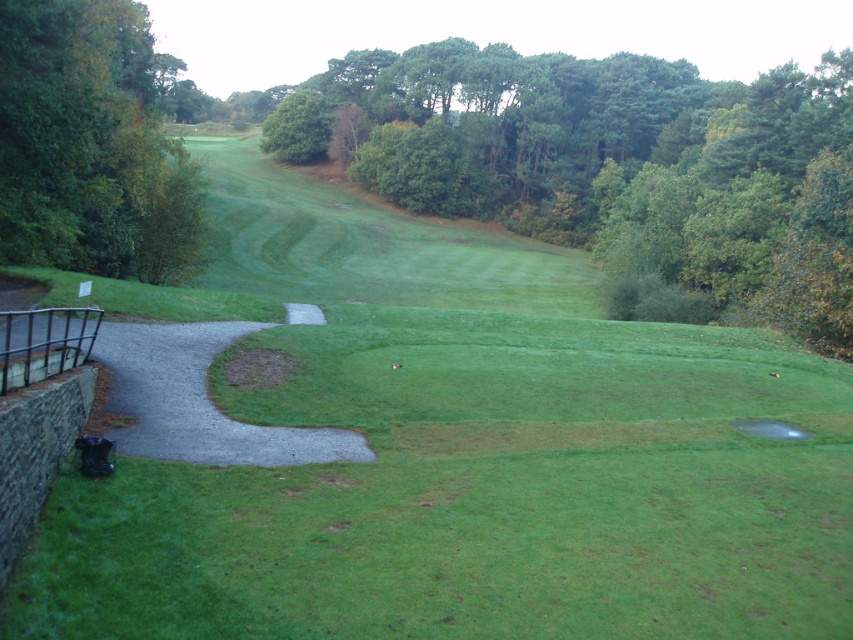
Question: Among these objects, which one is farthest from the camera?

Choices:
 (A) green leafy trees at center
 (B) gray gravel path at left
 (C) transparent plastic hole at center

Answer: (A)

Question: Can you confirm if green leafy tree at left is bigger than transparent plastic hole at center?

Choices:
 (A) no
 (B) yes

Answer: (B)

Question: Which point is closer to the camera?

Choices:
 (A) (409, 161)
 (B) (149, 333)
 (C) (6, 195)
 (D) (755, 420)

Answer: (D)

Question: Among these objects, which one is nearest to the camera?

Choices:
 (A) transparent plastic hole at center
 (B) green leafy tree at left
 (C) gray gravel path at left

Answer: (C)

Question: From the image, what is the correct spatial relationship of green leafy trees at center in relation to gray gravel path at left?

Choices:
 (A) below
 (B) above

Answer: (B)

Question: Can you confirm if green leafy tree at left is positioned below transparent plastic hole at center?

Choices:
 (A) yes
 (B) no

Answer: (B)